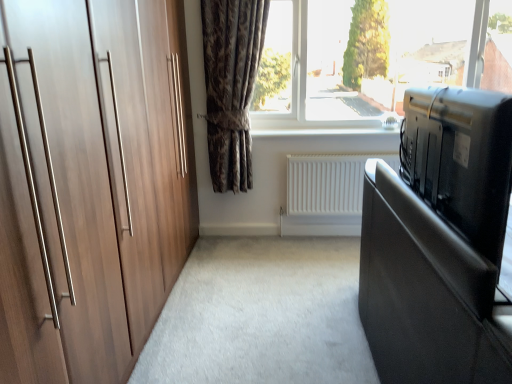
In order to click on vacant area on top of smooth black bed at right (from a real-world perspective) in this screenshot , I will do `click(256, 299)`.